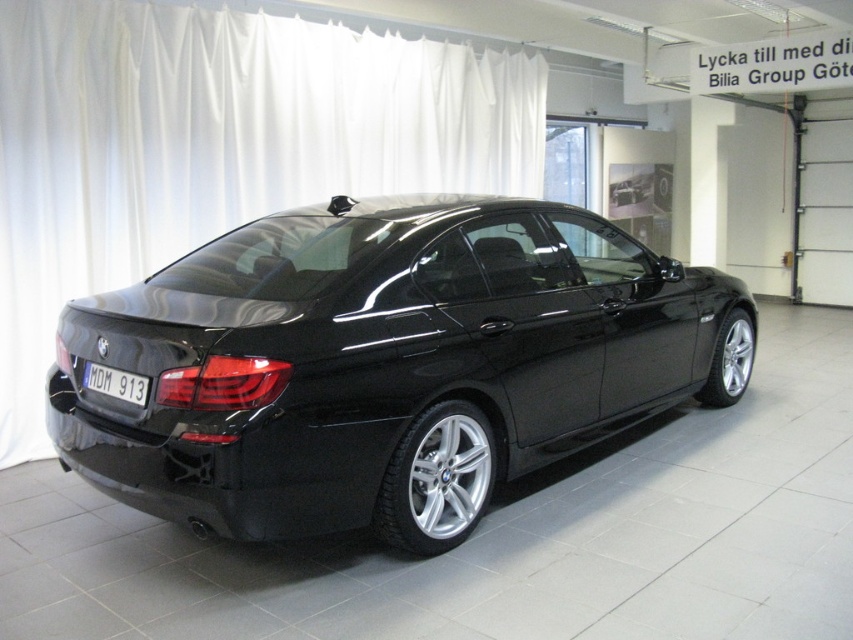
You are a photographer setting up a shot of the black BMW car. You notice the white matte curtain at upper center and the black plastic license plate at lower center. Which object is positioned higher in the image?

The white matte curtain at upper center is positioned higher in the image than the black plastic license plate at lower center because it is much taller.

You are a photographer trying to capture the black glossy sedan at center and the black plastic license plate at lower center in a single frame. Since the sedan is taller than the license plate, which object should you focus on first to ensure both are in focus?

The black glossy sedan at center is taller than the black plastic license plate at lower center. To ensure both are in focus, you should focus on the black glossy sedan at center first because it is larger in the frame, allowing the license plate to fall within the depth of field.

You are standing in front of the BMW car and want to see both the white matte curtain at upper center and the black plastic license plate at lower center. Which object would appear closer to you?

The white matte curtain at upper center would appear closer to you because it is further to the viewer than the black plastic license plate at lower center.